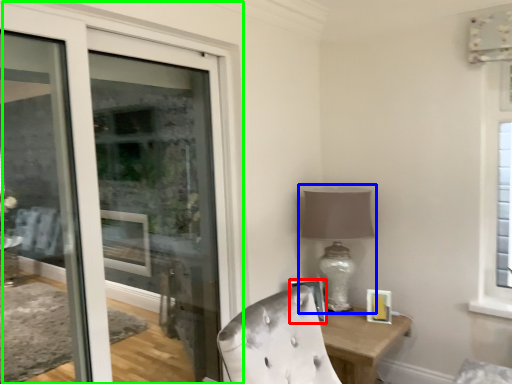
Question: Which object is positioned farthest from picture frame (highlighted by a red box)? Select from table lamp (highlighted by a blue box) and door (highlighted by a green box).

Choices:
 (A) table lamp
 (B) door

Answer: (B)